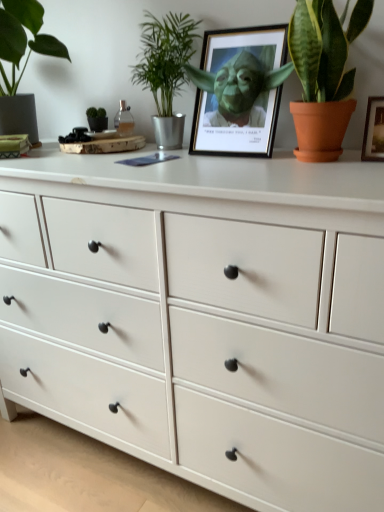
This screenshot has height=512, width=384. I want to click on vacant area that lies between green glossy leafy plant at upper right, the 3th houseplant positioned from the left, and matte black picture frame at center, so click(232, 157).